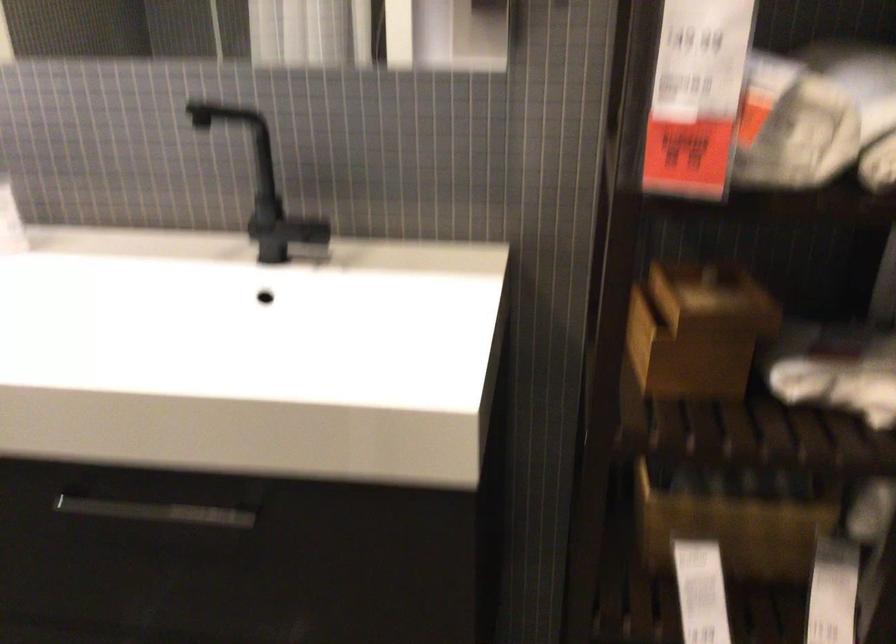
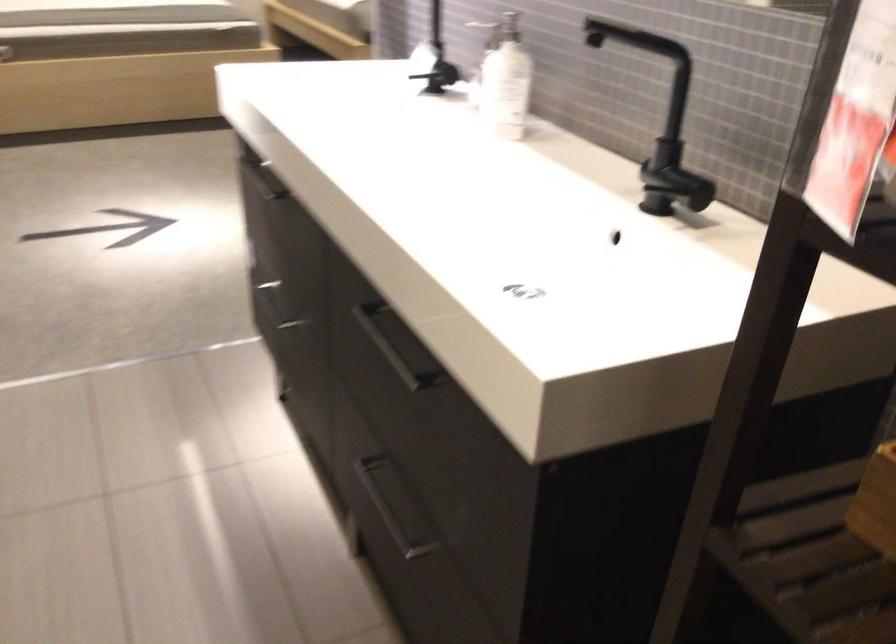
Question: The camera is either moving clockwise (left) or counter-clockwise (right) around the object. The first image is from the beginning of the video and the second image is from the end. Is the camera moving left or right when shooting the video?

Choices:
 (A) Left
 (B) Right

Answer: (B)